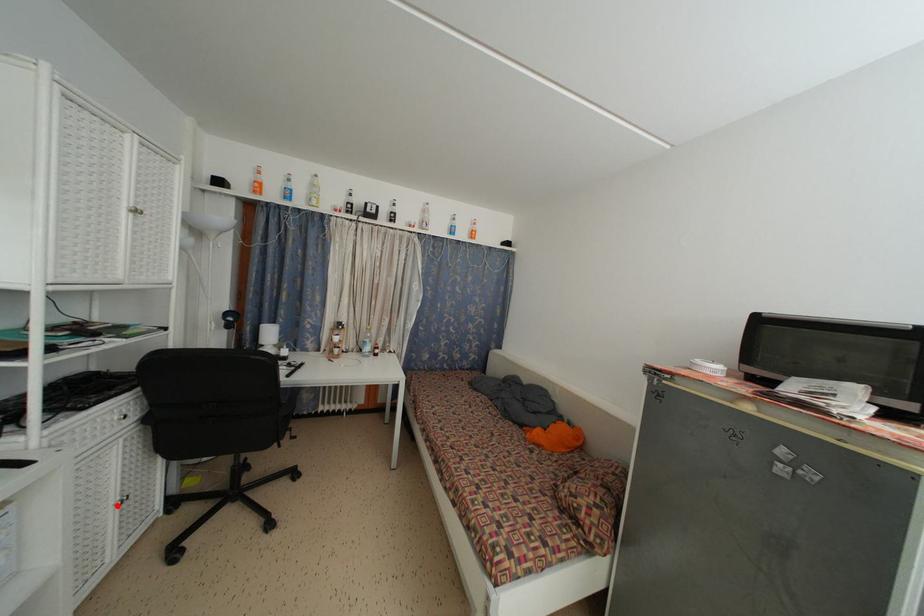
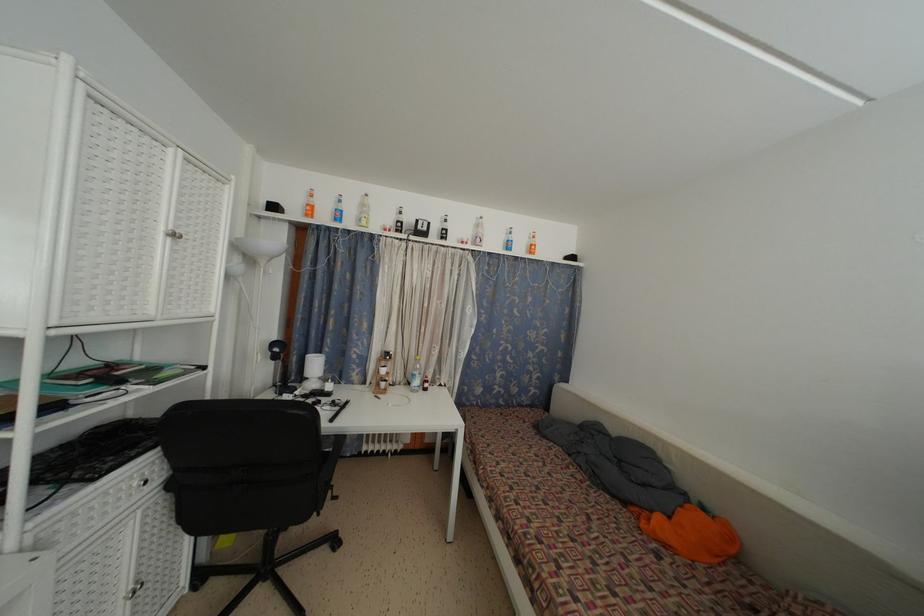
In the second image, find the point that corresponds to the highlighted location in the first image.

(129, 594)